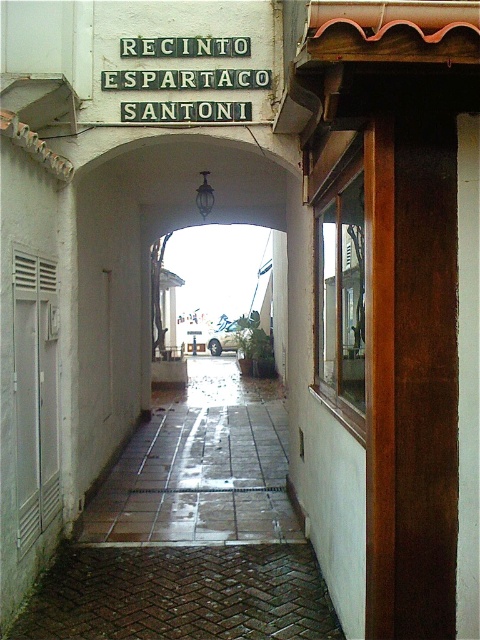
You are standing at the entrance of Recinto Espartaco Santoni and want to step onto the brown tile pavement at center. Given that your shoes have a grip of 0.5, and the floor at point (202, 468) has a slipperiness of 0.6, will you be able to walk safely to the brown tile pavement at center?

The floor at point (202, 468) has a slipperiness of 0.6, which is higher than your shoe grip of 0.5. Therefore, walking to the brown tile pavement at center may be slippery and not safe.

You are standing at the entrance of the building and want to place a small potted plant between the brown tile pavement at center and the green metal sign at upper center. Considering their heights, which object should the plant be placed closer to?

The brown tile pavement at center has a lesser height compared to the green metal sign at upper center, so the plant should be placed closer to the brown tile pavement at center to ensure stability and visibility.